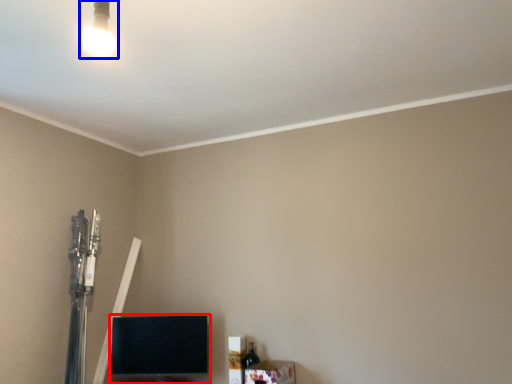
Question: Which of the following is the farthest to the observer, furniture (highlighted by a red box) or lamp (highlighted by a blue box)?

Choices:
 (A) furniture
 (B) lamp

Answer: (A)